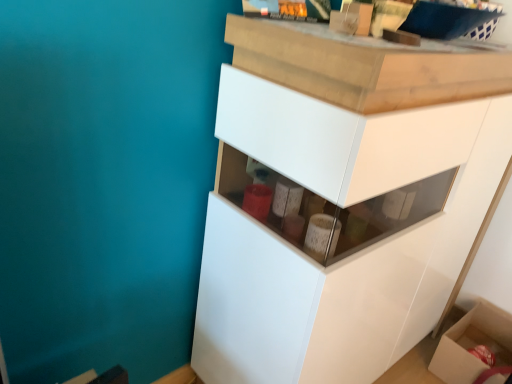
Question: Considering the positions of cardboard box at lower right and white glossy cabinet at center in the image, is cardboard box at lower right taller or shorter than white glossy cabinet at center?

Choices:
 (A) short
 (B) tall

Answer: (A)

Question: Relative to white glossy cabinet at center, is cardboard box at lower right in front or behind?

Choices:
 (A) front
 (B) behind

Answer: (B)

Question: Based on their sizes in the image, would you say cardboard box at lower right is bigger or smaller than white glossy cabinet at center?

Choices:
 (A) big
 (B) small

Answer: (B)

Question: In terms of width, does white glossy cabinet at center look wider or thinner when compared to cardboard box at lower right?

Choices:
 (A) thin
 (B) wide

Answer: (B)

Question: In terms of size, does white glossy cabinet at center appear bigger or smaller than cardboard box at lower right?

Choices:
 (A) small
 (B) big

Answer: (B)

Question: Considering the positions of white glossy cabinet at center and cardboard box at lower right in the image, is white glossy cabinet at center taller or shorter than cardboard box at lower right?

Choices:
 (A) tall
 (B) short

Answer: (A)

Question: Is point (332, 165) closer or farther from the camera than point (455, 326)?

Choices:
 (A) closer
 (B) farther

Answer: (A)